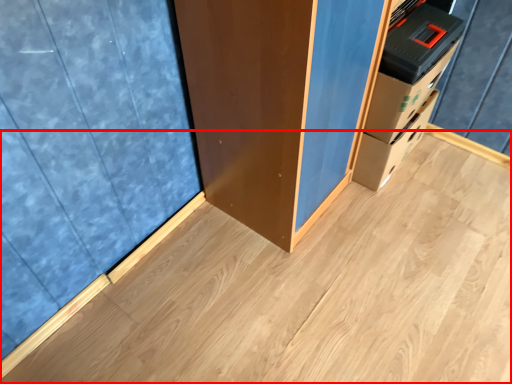
Question: Where is plywood (annotated by the red box) located in relation to curtain in the image?

Choices:
 (A) left
 (B) right

Answer: (B)